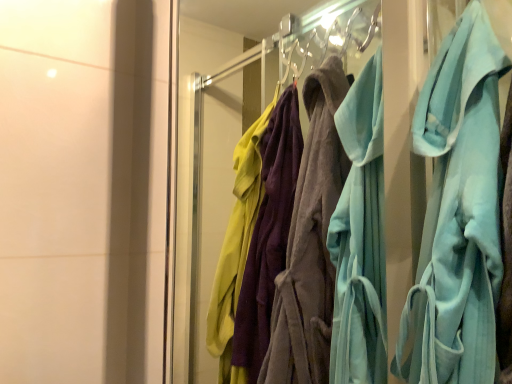
Locate an element on the screen. This screenshot has width=512, height=384. light blue fabric at center is located at coordinates (457, 213).

What do you see at coordinates (457, 213) in the screenshot?
I see `light blue fabric at center` at bounding box center [457, 213].

Where is `light blue fabric at center`? The image size is (512, 384). light blue fabric at center is located at coordinates (457, 213).